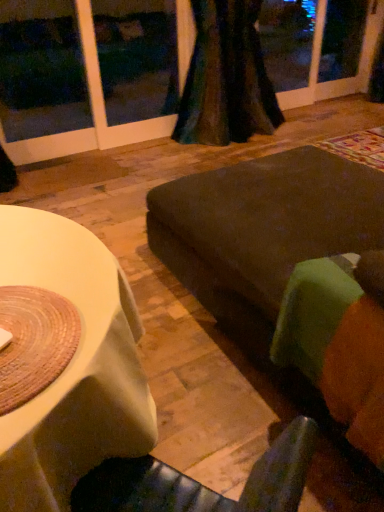
Question: In which direction should I rotate to look at dark brown fabric couch at center, which appears as the 1th couch when viewed from the back?

Choices:
 (A) right
 (B) left

Answer: (A)

Question: Is green fabric couch at lower right, the first couch in the front-to-back sequence, taller than dark brown fabric couch at center, placed as the second couch when sorted from front to back?

Choices:
 (A) yes
 (B) no

Answer: (B)

Question: Does green fabric couch at lower right, the second couch in the back-to-front sequence, have a larger size compared to dark brown fabric couch at center, which appears as the 1th couch when viewed from the back?

Choices:
 (A) yes
 (B) no

Answer: (B)

Question: Is green fabric couch at lower right, the second couch in the back-to-front sequence, positioned with its back to dark brown fabric couch at center, placed as the second couch when sorted from front to back?

Choices:
 (A) yes
 (B) no

Answer: (B)

Question: Does green fabric couch at lower right, the second couch in the back-to-front sequence, have a greater width compared to dark brown fabric couch at center, placed as the second couch when sorted from front to back?

Choices:
 (A) yes
 (B) no

Answer: (B)

Question: From the image's perspective, does green fabric couch at lower right, the first couch in the front-to-back sequence, appear lower than dark brown fabric couch at center, placed as the second couch when sorted from front to back?

Choices:
 (A) yes
 (B) no

Answer: (A)

Question: Are green fabric couch at lower right, the first couch in the front-to-back sequence, and dark brown fabric couch at center, which appears as the 1th couch when viewed from the back, located far from each other?

Choices:
 (A) no
 (B) yes

Answer: (A)

Question: From a real-world perspective, is green fabric couch at lower right, the first couch in the front-to-back sequence, positioned over velvet dark green curtain at upper center based on gravity?

Choices:
 (A) yes
 (B) no

Answer: (B)

Question: Is green fabric couch at lower right, the first couch in the front-to-back sequence, at the right side of velvet dark green curtain at upper center?

Choices:
 (A) no
 (B) yes

Answer: (B)

Question: Can you confirm if green fabric couch at lower right, the first couch in the front-to-back sequence, is taller than velvet dark green curtain at upper center?

Choices:
 (A) yes
 (B) no

Answer: (B)

Question: Can you confirm if green fabric couch at lower right, the first couch in the front-to-back sequence, is thinner than velvet dark green curtain at upper center?

Choices:
 (A) yes
 (B) no

Answer: (B)

Question: From the image's perspective, does green fabric couch at lower right, the second couch in the back-to-front sequence, appear higher than velvet dark green curtain at upper center?

Choices:
 (A) no
 (B) yes

Answer: (A)

Question: Is green fabric couch at lower right, the second couch in the back-to-front sequence, located outside velvet dark green curtain at upper center?

Choices:
 (A) no
 (B) yes

Answer: (B)

Question: Does dark brown fabric couch at center, placed as the second couch when sorted from front to back, have a lesser width compared to velvet dark green curtain at upper center?

Choices:
 (A) yes
 (B) no

Answer: (B)